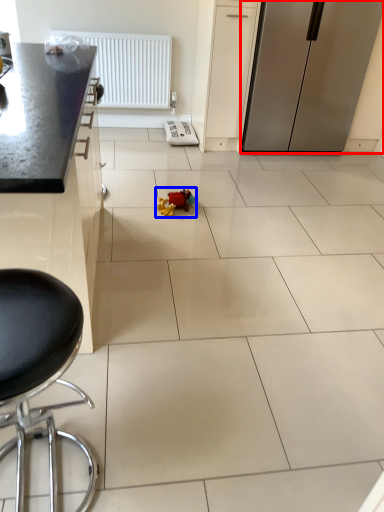
Question: Which object appears closest to the camera in this image, refrigerator (highlighted by a red box) or toy (highlighted by a blue box)?

Choices:
 (A) refrigerator
 (B) toy

Answer: (B)